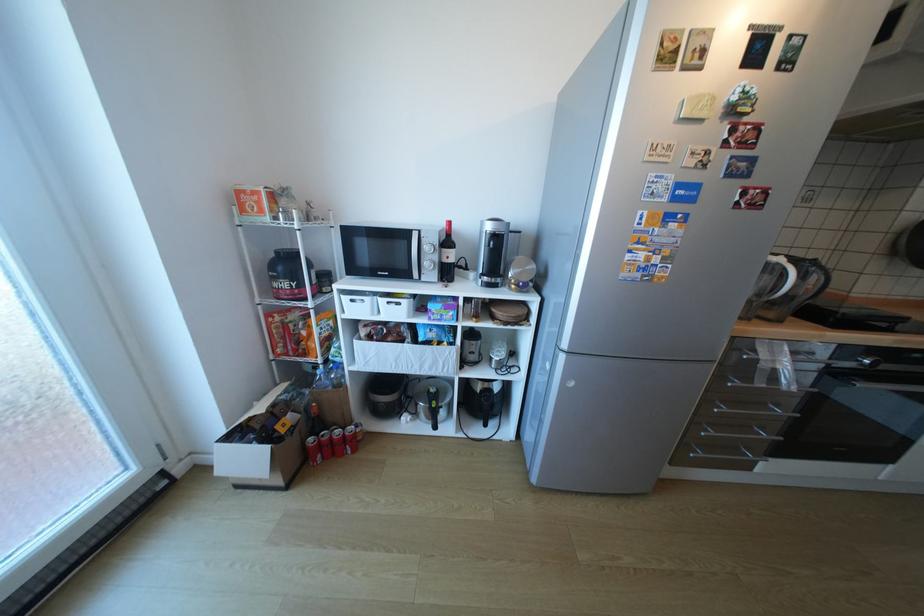
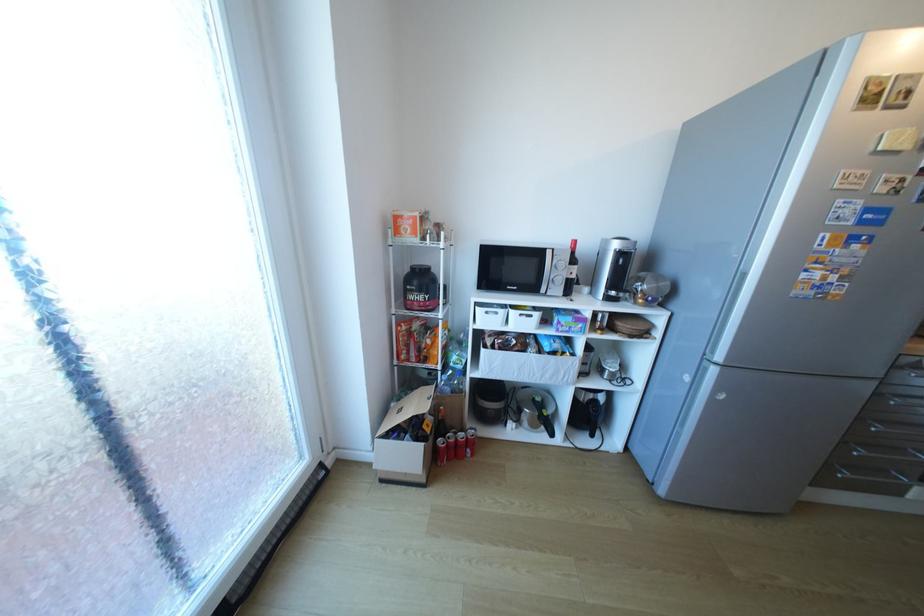
Locate, in the second image, the point that corresponds to pixel 688 460 in the first image.

(834, 480)